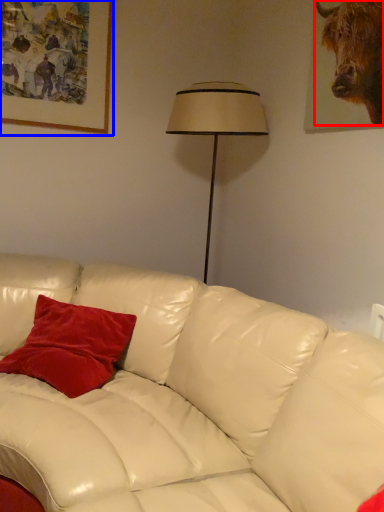
Question: Which object appears farthest to the camera in this image, bull (highlighted by a red box) or picture frame (highlighted by a blue box)?

Choices:
 (A) bull
 (B) picture frame

Answer: (B)